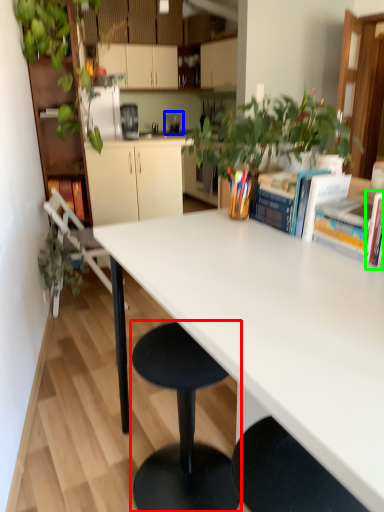
Question: Which is farther away from stool (highlighted by a red box)? appliance (highlighted by a blue box) or book (highlighted by a green box)?

Choices:
 (A) appliance
 (B) book

Answer: (A)